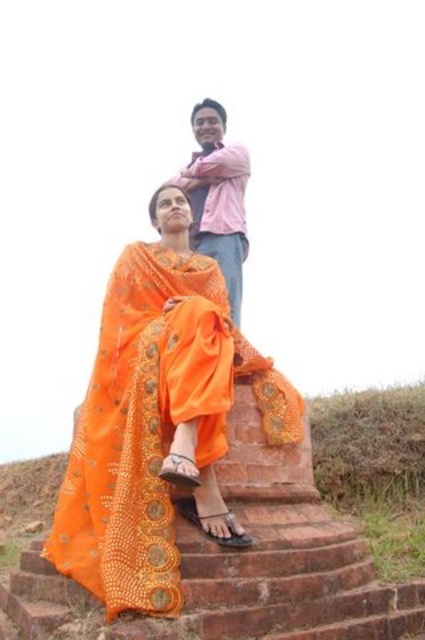
Does orange sheer fabric at center have a lesser width compared to pink cotton shirt at upper center?

No, orange sheer fabric at center is not thinner than pink cotton shirt at upper center.

Does point (295, 401) lie behind point (214, 152)?

No, (295, 401) is closer to viewer.

The height and width of the screenshot is (640, 425). Find the location of `orange sheer fabric at center`. orange sheer fabric at center is located at coordinates (164, 396).